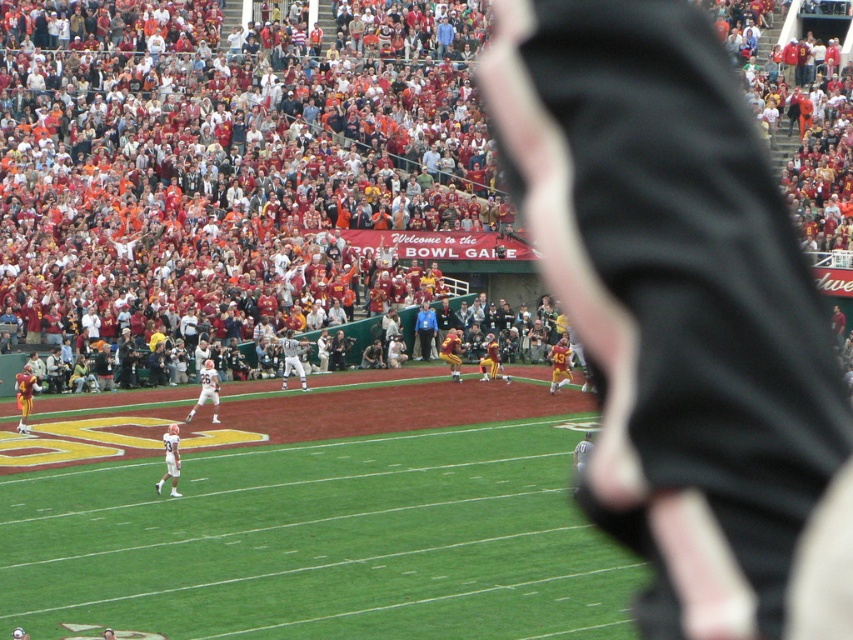
Question: Which point is closer to the camera?

Choices:
 (A) yellow jersey at lower right
 (B) red fabric crowd at upper center
 (C) white matte football player at center

Answer: (C)

Question: Can you confirm if yellow jersey at lower right is positioned above matte yellow helmet at center?

Choices:
 (A) yes
 (B) no

Answer: (B)

Question: Does white matte jersey at center lie behind matte yellow helmet at center?

Choices:
 (A) yes
 (B) no

Answer: (B)

Question: Where is green grass football field at center located in relation to yellow-orange jersey at center in the image?

Choices:
 (A) above
 (B) below

Answer: (B)

Question: Which object is the closest to the red fabric crowd at upper center?

Choices:
 (A) matte yellow helmet at center
 (B) white matte football player at center

Answer: (A)

Question: Which object appears farthest from the camera in this image?

Choices:
 (A) white matte jersey at center
 (B) yellow jersey at lower right
 (C) yellow-orange jersey at center

Answer: (B)